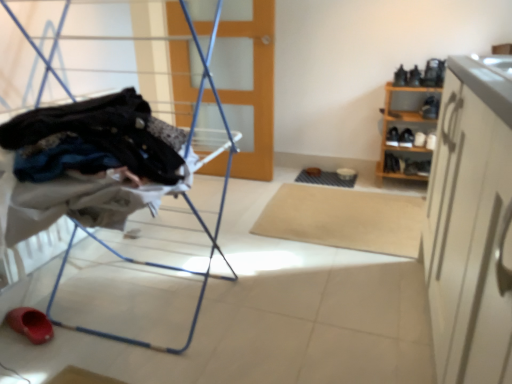
Where is `free point to the right of wooden at center`? free point to the right of wooden at center is located at coordinates (286, 176).